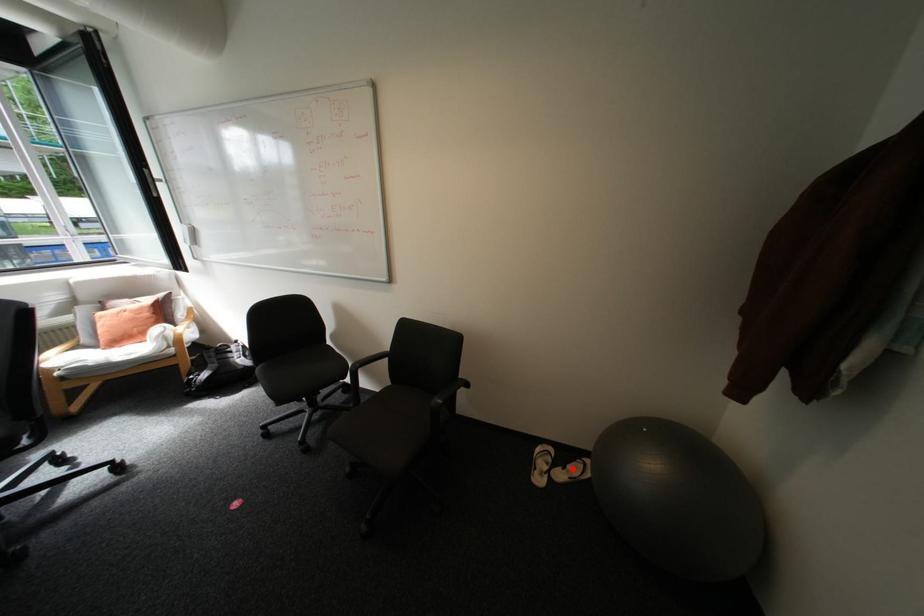
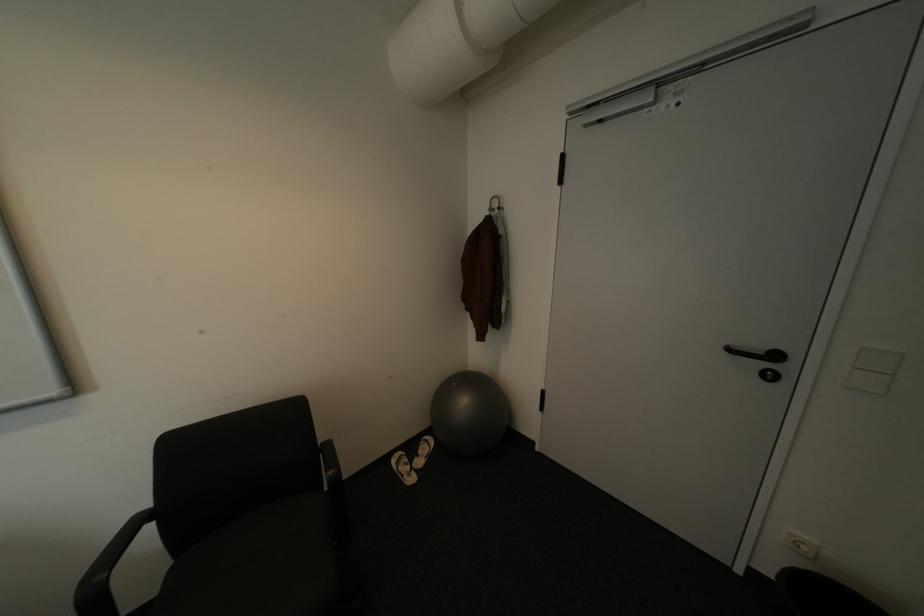
Question: I am providing you with two images of the same scene from different viewpoints. Given a red point in image1, look at the same physical point in image2. Is it:

Choices:
 (A) Closer to the viewpoint
 (B) Farther from the viewpoint

Answer: (B)